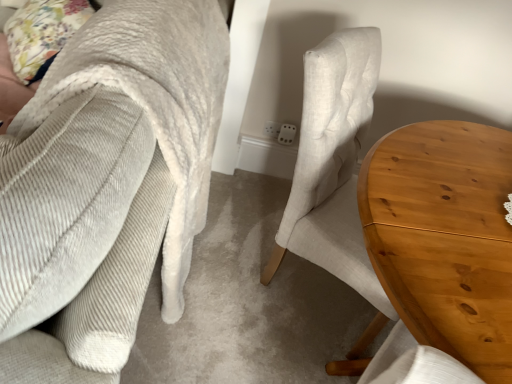
Question: Is light brown wood table at center right positioned far away from floral fabric pillow at upper left?

Choices:
 (A) yes
 (B) no

Answer: (A)

Question: From the image's perspective, does light brown wood table at center right appear lower than floral fabric pillow at upper left?

Choices:
 (A) no
 (B) yes

Answer: (B)

Question: From a real-world perspective, is light brown wood table at center right on floral fabric pillow at upper left?

Choices:
 (A) yes
 (B) no

Answer: (B)

Question: Can you confirm if light brown wood table at center right is bigger than floral fabric pillow at upper left?

Choices:
 (A) yes
 (B) no

Answer: (A)

Question: Can you confirm if light brown wood table at center right is shorter than floral fabric pillow at upper left?

Choices:
 (A) no
 (B) yes

Answer: (A)

Question: Does light brown wood table at center right have a greater width compared to floral fabric pillow at upper left?

Choices:
 (A) no
 (B) yes

Answer: (B)

Question: Is floral fabric pillow at upper left at the back of corduroy fabric chair at center?

Choices:
 (A) yes
 (B) no

Answer: (A)

Question: Is corduroy fabric chair at center facing towards floral fabric pillow at upper left?

Choices:
 (A) no
 (B) yes

Answer: (B)

Question: Is corduroy fabric chair at center thinner than floral fabric pillow at upper left?

Choices:
 (A) yes
 (B) no

Answer: (B)

Question: From a real-world perspective, is corduroy fabric chair at center under floral fabric pillow at upper left?

Choices:
 (A) yes
 (B) no

Answer: (A)

Question: From a real-world perspective, is corduroy fabric chair at center positioned over floral fabric pillow at upper left based on gravity?

Choices:
 (A) yes
 (B) no

Answer: (B)

Question: Considering the relative positions of corduroy fabric chair at center and floral fabric pillow at upper left in the image provided, is corduroy fabric chair at center behind floral fabric pillow at upper left?

Choices:
 (A) no
 (B) yes

Answer: (A)

Question: Can we say floral fabric pillow at upper left lies outside light brown wood table at center right?

Choices:
 (A) no
 (B) yes

Answer: (B)